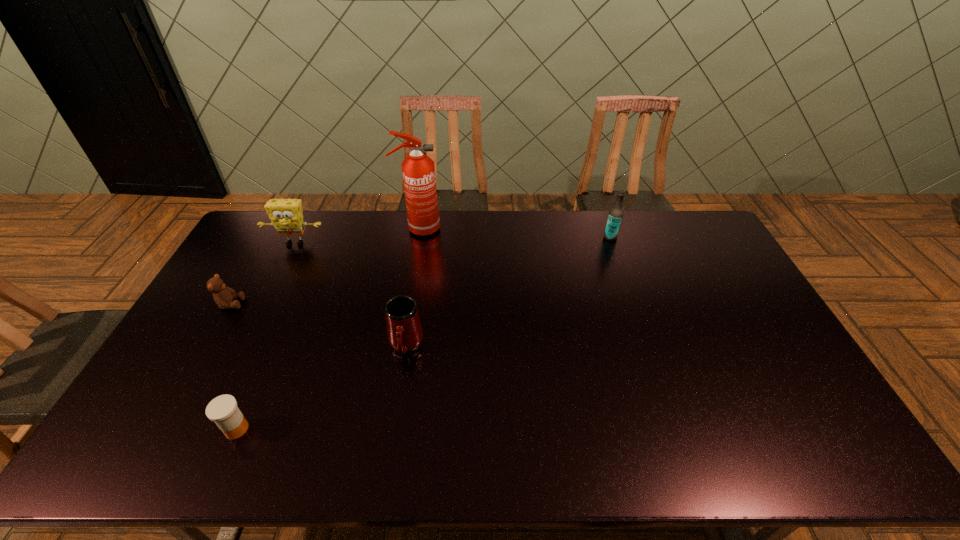
Identify the location of teddy bear located at the left edge. This screenshot has width=960, height=540. tap(223, 296).

I want to click on object positioned at the far left corner, so click(x=286, y=215).

This screenshot has height=540, width=960. Find the location of `vacant region at the far edge`. vacant region at the far edge is located at coordinates (442, 235).

In the image, there is a desktop. Identify the location of free space at the left edge. Image resolution: width=960 pixels, height=540 pixels. (248, 255).

Locate an element on the screen. free point at the right edge is located at coordinates (x=738, y=357).

The image size is (960, 540). Find the location of `free space between the teddy bear and the rightmost object`. free space between the teddy bear and the rightmost object is located at coordinates (420, 271).

You are a GUI agent. You are given a task and a screenshot of the screen. Output one action in this format:
    pyautogui.click(x=<x>, y=<y>)
    Task: Click on the free space between the rightmost object and the sponge
    The width and height of the screenshot is (960, 540).
    Given the screenshot: What is the action you would take?
    pyautogui.click(x=453, y=240)

Locate an element on the screen. blank region between the mug and the fire extinguisher is located at coordinates (412, 287).

Find the location of a particular element. free space between the rightmost object and the third nearest object is located at coordinates (420, 271).

Locate an element on the screen. free area in between the mug and the fourth farthest object is located at coordinates (318, 325).